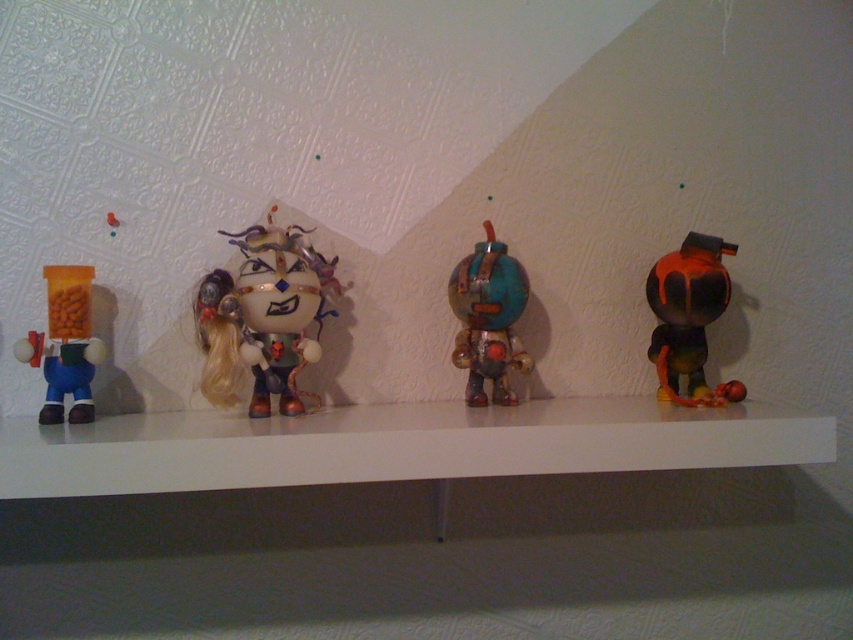
Does shiny orange and black robot at right appear over matte plastic toy at left?

Correct, shiny orange and black robot at right is located above matte plastic toy at left.

Does shiny orange and black robot at right appear under matte plastic toy at left?

No.

The height and width of the screenshot is (640, 853). What do you see at coordinates (688, 317) in the screenshot?
I see `shiny orange and black robot at right` at bounding box center [688, 317].

The height and width of the screenshot is (640, 853). I want to click on shiny orange and black robot at right, so click(x=688, y=317).

From the picture: Between white glossy mantle at center and matte plastic toy at left, which one appears on the left side from the viewer's perspective?

Positioned to the left is matte plastic toy at left.

Is point (664, 454) less distant than point (91, 344)?

Yes, point (664, 454) is closer to viewer.

This screenshot has width=853, height=640. I want to click on white glossy mantle at center, so click(x=398, y=444).

Does rusty metallic robot at center have a smaller size compared to matte plastic toy at left?

Incorrect, rusty metallic robot at center is not smaller in size than matte plastic toy at left.

Can you confirm if rusty metallic robot at center is positioned to the left of matte plastic toy at left?

No, rusty metallic robot at center is not to the left of matte plastic toy at left.

Between point (498, 368) and point (15, 355), which one is positioned in front?

Positioned in front is point (15, 355).

In order to click on rusty metallic robot at center in this screenshot , I will do `click(488, 317)`.